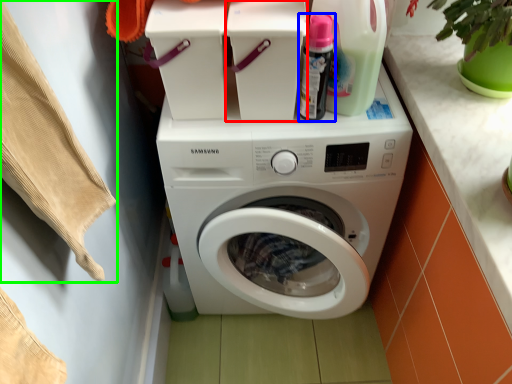
Question: Which object is the closest to the appliance (highlighted by a red box)? Choose among these: cleaning product (highlighted by a blue box) or clothing (highlighted by a green box).

Choices:
 (A) cleaning product
 (B) clothing

Answer: (A)